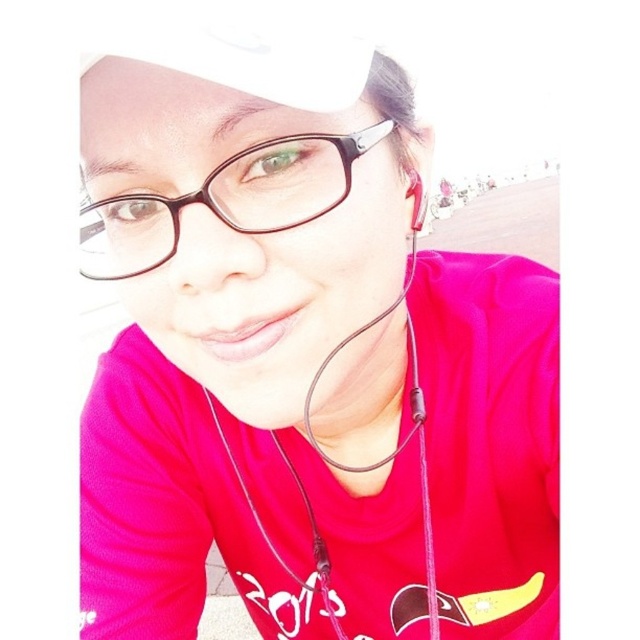
Can you confirm if black plastic glasses at center is shorter than matte black earphones at center?

Indeed, black plastic glasses at center has a lesser height compared to matte black earphones at center.

Who is taller, black plastic glasses at center or matte black earphones at center?

matte black earphones at center

The height and width of the screenshot is (640, 640). Describe the element at coordinates (225, 200) in the screenshot. I see `black plastic glasses at center` at that location.

Find the location of a particular element. This screenshot has width=640, height=640. black plastic glasses at center is located at coordinates [x=225, y=200].

In the scene shown: Can you confirm if matte black glasses at upper center is bigger than black plastic glasses at center?

Yes, matte black glasses at upper center is bigger than black plastic glasses at center.

Between matte black glasses at upper center and black plastic glasses at center, which one appears on the left side from the viewer's perspective?

black plastic glasses at center

Which is in front, point (275, 84) or point (122, 205)?

Positioned in front is point (275, 84).

Identify the location of matte black glasses at upper center. (301, 358).

Between matte black glasses at upper center and matte black earphone at upper center, which one has more height?

Standing taller between the two is matte black glasses at upper center.

Does matte black glasses at upper center have a lesser width compared to matte black earphone at upper center?

Incorrect, matte black glasses at upper center's width is not less than matte black earphone at upper center's.

Who is more forward, (150, 170) or (417, 208)?

Positioned in front is point (150, 170).

Identify the location of matte black glasses at upper center. The width and height of the screenshot is (640, 640). (301, 358).